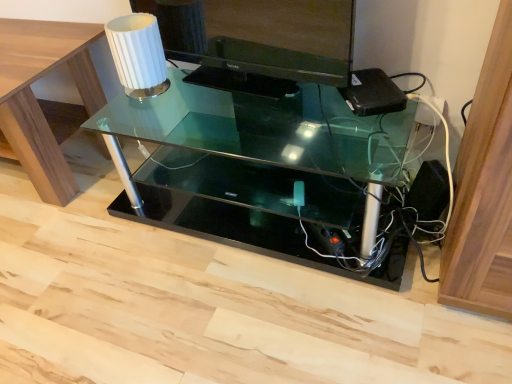
Question: In terms of width, does white ribbed glass at upper left look wider or thinner when compared to black glossy monitor at upper center?

Choices:
 (A) thin
 (B) wide

Answer: (B)

Question: From a real-world perspective, is white ribbed glass at upper left physically located above or below black glossy monitor at upper center?

Choices:
 (A) below
 (B) above

Answer: (A)

Question: Which of these objects is positioned closest to the clear glass table at upper left, the first table from the left?

Choices:
 (A) transparent glass table at center, which appears as the 1th table when viewed from the right
 (B) white ribbed glass at upper left
 (C) black glossy monitor at upper center

Answer: (B)

Question: Considering the real-world distances, which object is closest to the transparent glass table at center, which appears as the 1th table when viewed from the right?

Choices:
 (A) black glossy monitor at upper center
 (B) white ribbed glass at upper left
 (C) clear glass table at upper left, the first table from the left

Answer: (A)